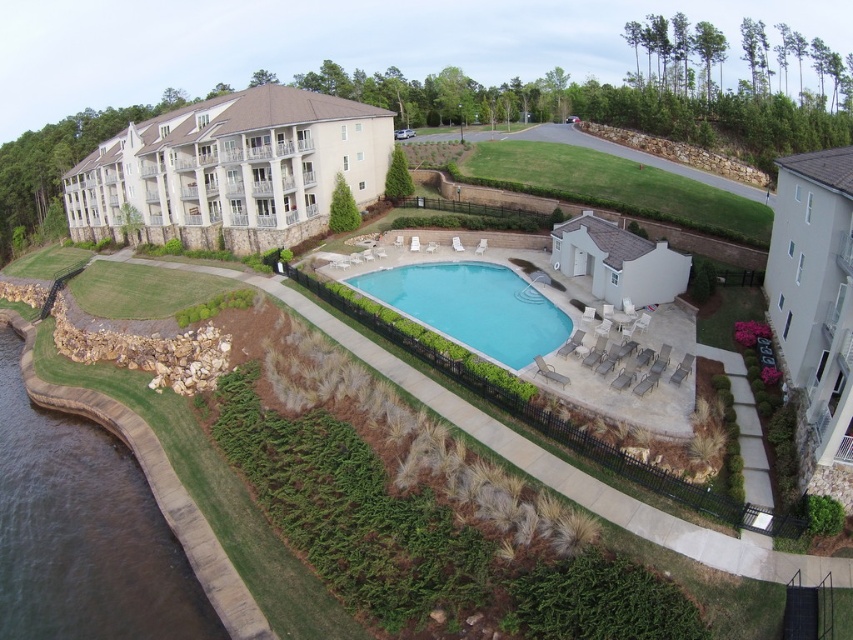
You are standing at the edge of the pool and want to walk to the lounge chairs. There is a dark brown concrete waterway at lower left and clear blue water at center in your path. Which object should you avoid stepping on to reach the lounge chairs safely?

You should avoid stepping on the dark brown concrete waterway at lower left because it is positioned under the clear blue water at center, meaning it might be a drain or a structure beneath the water that could be unsafe to step on.

You are planning to install a new floating platform in the pool area. The platform requires a space that is wider than the clear blue water at center. Can the dark brown concrete waterway at lower left accommodate this platform?

The dark brown concrete waterway at lower left is wider than the clear blue water at center, so it can accommodate the floating platform requiring a space wider than the clear blue water at center.

You are standing at the entrance of the residential complex and want to go to the clear blue water at center. There is a dark brown concrete waterway at lower left blocking your path. Can you walk around it on your right side?

The dark brown concrete waterway at lower left is to the left of clear blue water at center, so yes, you can walk around it on your right side to reach the clear blue water at center.